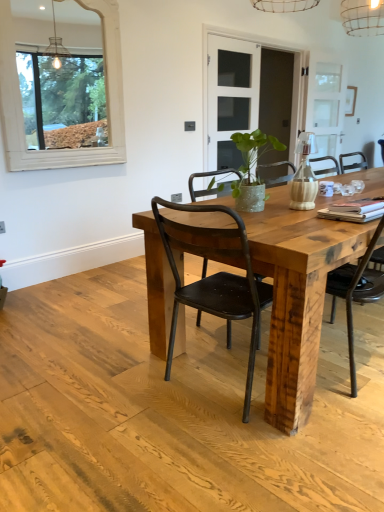
The width and height of the screenshot is (384, 512). Identify the location of free space behind matte white vase at center. (287, 201).